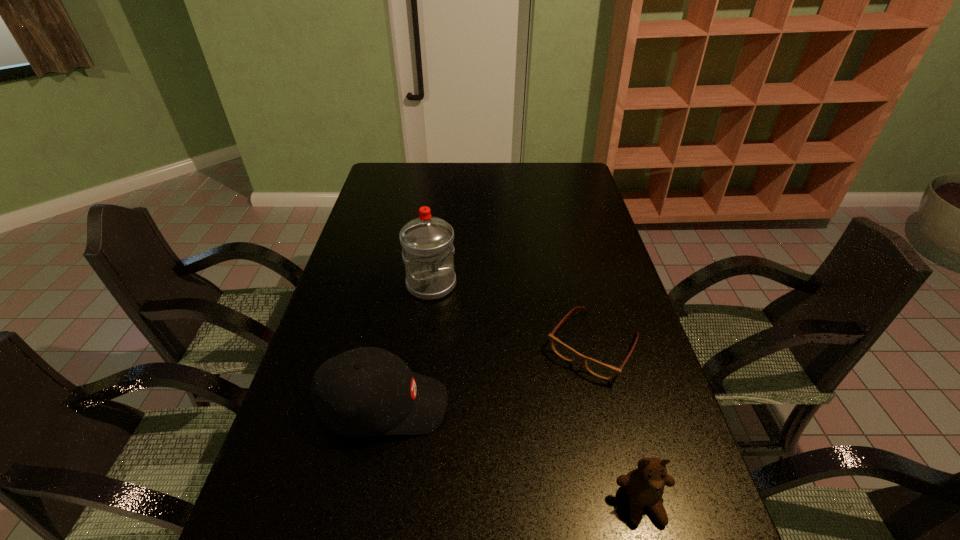
Locate an element on the screen. free space located 0.050m on the front-facing side of the shortest object is located at coordinates (562, 392).

Locate an element on the screen. vacant space situated 0.050m on the front-facing side of the shortest object is located at coordinates (562, 392).

Identify the location of object that is at the near edge. (645, 485).

Where is `object situated at the left edge`? object situated at the left edge is located at coordinates (366, 391).

Image resolution: width=960 pixels, height=540 pixels. What are the coordinates of `teddy bear at the right edge` in the screenshot? It's located at (645, 485).

Where is `spectacles positioned at the right edge`? This screenshot has width=960, height=540. spectacles positioned at the right edge is located at coordinates (604, 371).

This screenshot has width=960, height=540. Find the location of `object located at the near right corner`. object located at the near right corner is located at coordinates (645, 485).

Identify the location of vacant area at the far edge. Image resolution: width=960 pixels, height=540 pixels. (485, 168).

In the image, there is a desktop. Identify the location of free space at the left edge. (347, 274).

Where is `free space at the right edge of the desktop`? The width and height of the screenshot is (960, 540). free space at the right edge of the desktop is located at coordinates (568, 248).